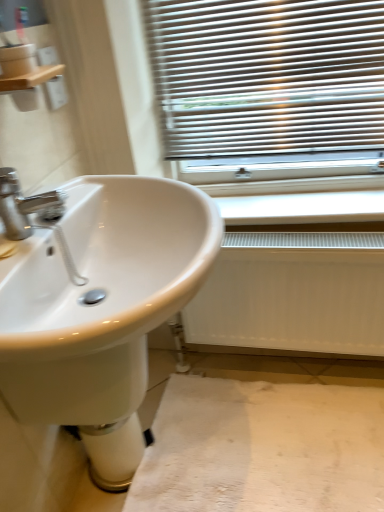
Question: From a real-world perspective, does white fabric at lower center stand above white plastic radiator at lower center?

Choices:
 (A) no
 (B) yes

Answer: (A)

Question: Does white fabric at lower center have a smaller size compared to white plastic radiator at lower center?

Choices:
 (A) no
 (B) yes

Answer: (A)

Question: Is the position of white fabric at lower center less distant than that of white plastic radiator at lower center?

Choices:
 (A) yes
 (B) no

Answer: (A)

Question: Would you say white fabric at lower center is outside white plastic radiator at lower center?

Choices:
 (A) no
 (B) yes

Answer: (B)

Question: Does white fabric at lower center touch white plastic radiator at lower center?

Choices:
 (A) no
 (B) yes

Answer: (A)

Question: Is there a large distance between white fabric at lower center and white plastic radiator at lower center?

Choices:
 (A) yes
 (B) no

Answer: (B)

Question: From a real-world perspective, is wooden shelf at upper left under white glossy bidet at lower center?

Choices:
 (A) yes
 (B) no

Answer: (B)

Question: Is white glossy bidet at lower center at the back of wooden shelf at upper left?

Choices:
 (A) no
 (B) yes

Answer: (A)

Question: Can you confirm if wooden shelf at upper left is bigger than white glossy bidet at lower center?

Choices:
 (A) no
 (B) yes

Answer: (A)

Question: Is wooden shelf at upper left oriented towards white glossy bidet at lower center?

Choices:
 (A) no
 (B) yes

Answer: (A)

Question: Does wooden shelf at upper left have a greater width compared to white glossy bidet at lower center?

Choices:
 (A) yes
 (B) no

Answer: (B)

Question: From the image's perspective, would you say wooden shelf at upper left is positioned over white glossy bidet at lower center?

Choices:
 (A) yes
 (B) no

Answer: (A)

Question: Is white glossy bidet at lower center next to white fabric at lower center?

Choices:
 (A) no
 (B) yes

Answer: (A)